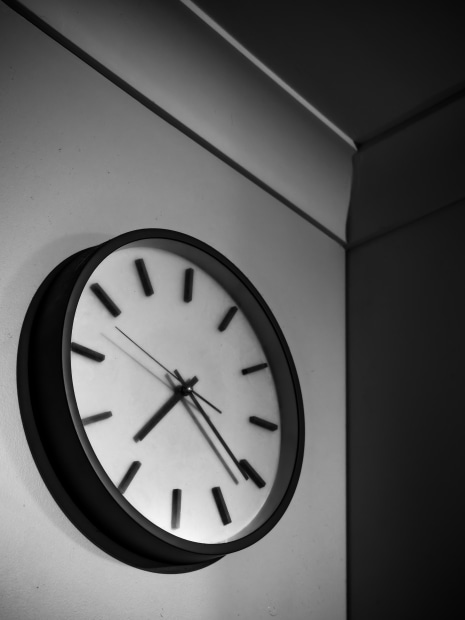
Identify the location of wall. (322, 350), (440, 379).